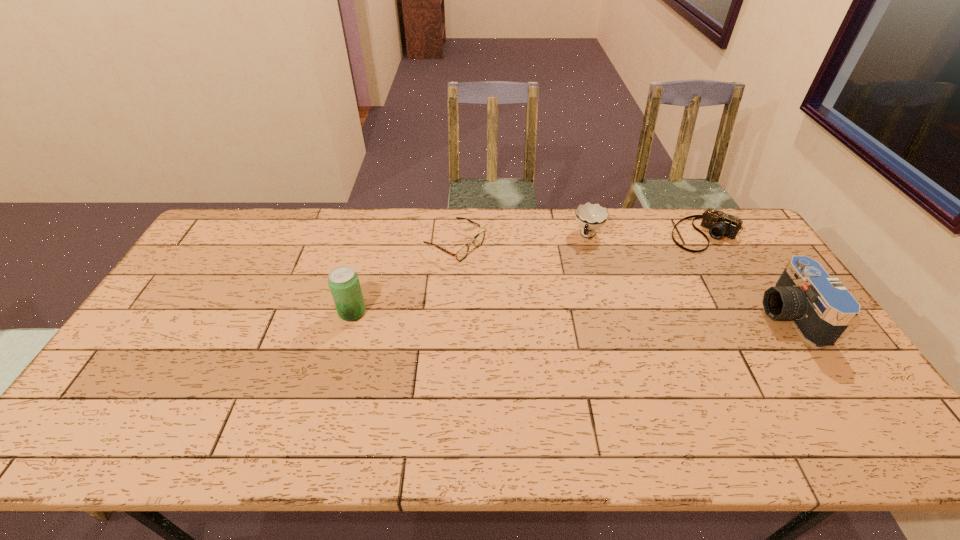
At what (x,y) coordinates should I click in order to perform the action: click on free spot on the desktop that is between the leftmost object and the nearer camera and is positioned on the frame of the spectacles. Please return your answer as a coordinate pair (x, y). Looking at the image, I should click on (590, 314).

What are the coordinates of `vacant spot on the desktop that is between the leftmost object and the taller camera and is positioned on the front-facing side of the second shortest object` in the screenshot? It's located at (628, 314).

This screenshot has width=960, height=540. I want to click on vacant spot on the desktop that is between the leftmost object and the taller camera and is positioned on the side of the third shortest object with the handle, so click(557, 314).